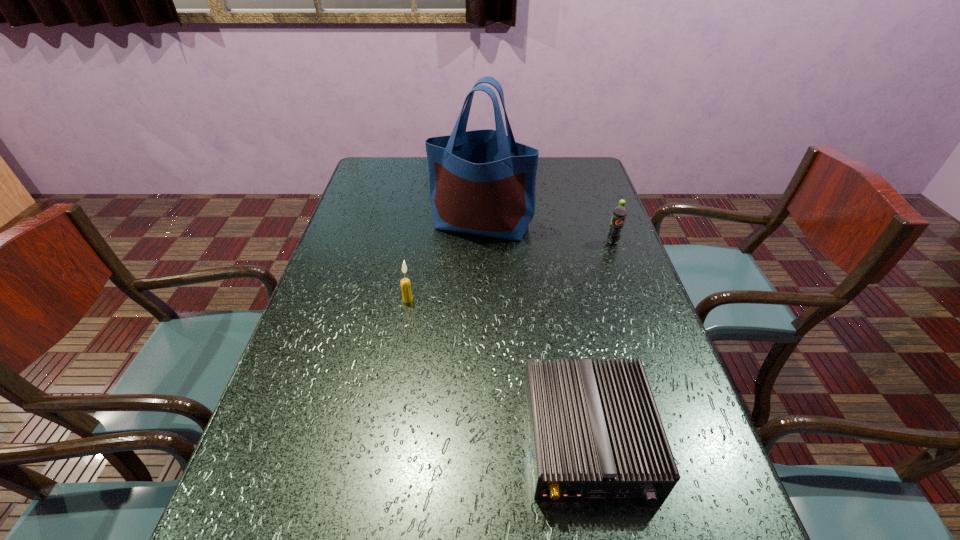
Identify the location of router that is at the right edge. Image resolution: width=960 pixels, height=540 pixels. (x=595, y=432).

Locate an element on the screen. vacant region at the far edge of the desktop is located at coordinates (549, 174).

Locate an element on the screen. The image size is (960, 540). vacant space at the left edge is located at coordinates (354, 283).

Where is `free space at the right edge of the desktop`? The height and width of the screenshot is (540, 960). free space at the right edge of the desktop is located at coordinates (603, 192).

The height and width of the screenshot is (540, 960). What are the coordinates of `free space at the far left corner` in the screenshot? It's located at (379, 171).

Image resolution: width=960 pixels, height=540 pixels. Identify the location of free spot at the far right corner of the desktop. (551, 160).

The width and height of the screenshot is (960, 540). What are the coordinates of `free spot between the nearest object and the leftmost object` in the screenshot? It's located at (498, 368).

The height and width of the screenshot is (540, 960). I want to click on empty space between the third farthest object and the soda, so click(x=510, y=271).

This screenshot has height=540, width=960. What are the coordinates of `vacant space that is in between the nearest object and the third farthest object` in the screenshot? It's located at (498, 368).

The height and width of the screenshot is (540, 960). I want to click on vacant area between the soda and the router, so click(x=600, y=340).